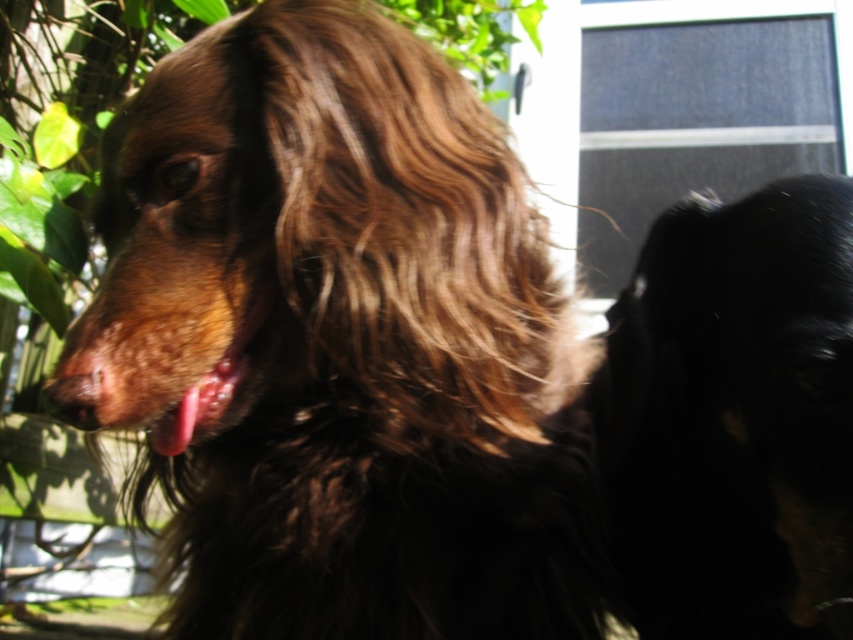
You are holding a 24 inch long pole and want to place it from the camera to the point at point (57, 371). Will the pole reach the point?

The distance of point (57, 371) from camera is 25.02 inches. Since the pole is 24 inches long, it is 1.02 inches shorter than needed, so the pole will not reach the point.

In the scene shown: You are standing in the garden and see the point marked at coordinates (x=734, y=417). What is located at that point?

The point at coordinates (x=734, y=417) marks the location of the black fur dog at right.

You are a photographer trying to capture the dog in the scene. You notice two points marked in the image. One is at coordinate point (706, 584) and the other at point (704, 83). If you want to focus on the point closer to the dog, which coordinate should you choose?

Point (706, 584) is in front of point (704, 83), so you should focus on point (706, 584) to capture the dog closer.